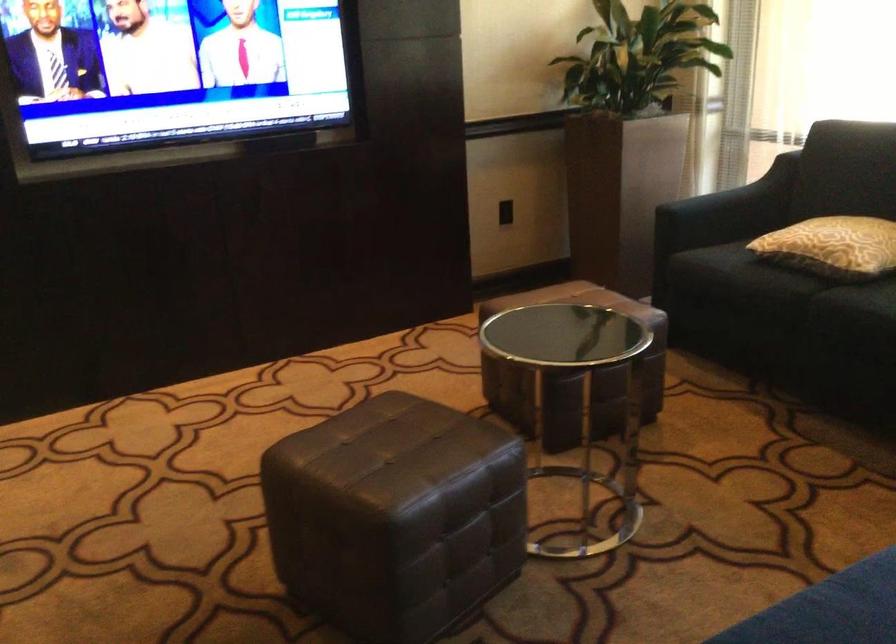
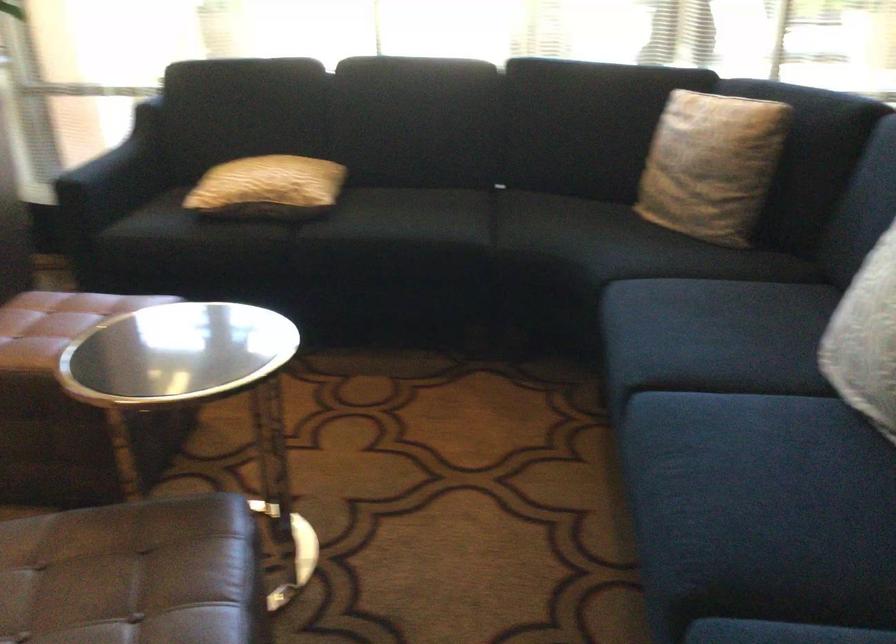
In the second image, find the point that corresponds to point (713, 209) in the first image.

(115, 176)